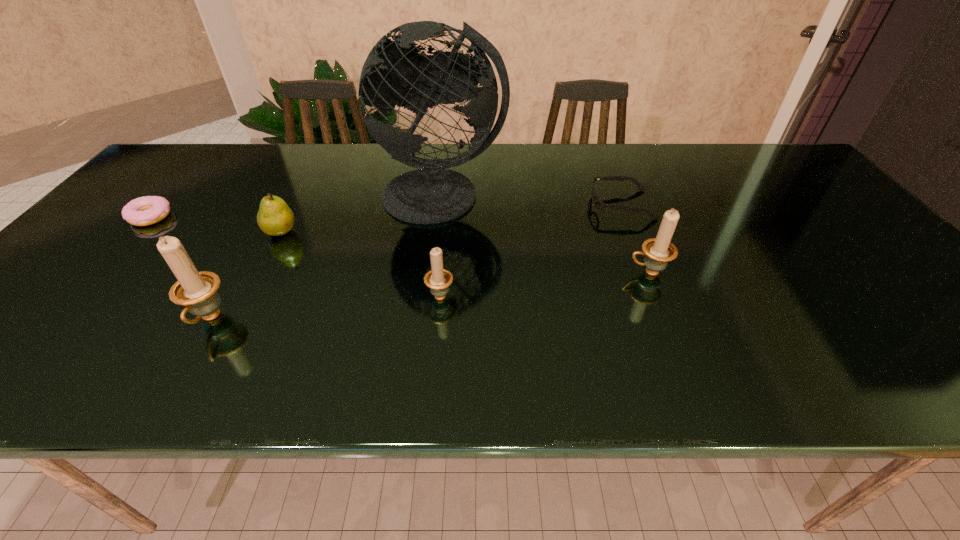
Locate an element on the screen. The width and height of the screenshot is (960, 540). vacant space located 0.150m on the front-facing side of the spectacles is located at coordinates (537, 205).

At what (x,y) coordinates should I click in order to perform the action: click on blank area located on the front-facing side of the spectacles. Please return your answer as a coordinate pair (x, y). The image size is (960, 540). Looking at the image, I should click on (533, 205).

Locate an element on the screen. This screenshot has width=960, height=540. object situated at the far edge is located at coordinates (394, 73).

Locate an element on the screen. The width and height of the screenshot is (960, 540). object present at the near edge is located at coordinates (197, 291).

Identify the location of object located in the left edge section of the desktop. The image size is (960, 540). click(147, 210).

This screenshot has height=540, width=960. Identify the location of vacant region at the far edge. (624, 174).

The width and height of the screenshot is (960, 540). Identify the location of vacant area at the near edge of the desktop. (291, 313).

The height and width of the screenshot is (540, 960). In the image, there is a desktop. What are the coordinates of `vacant space at the left edge` in the screenshot? It's located at (161, 187).

Find the location of a particular element. The height and width of the screenshot is (540, 960). free location at the right edge is located at coordinates (871, 254).

The image size is (960, 540). Find the location of `vacant space at the far left corner of the desktop`. vacant space at the far left corner of the desktop is located at coordinates (175, 161).